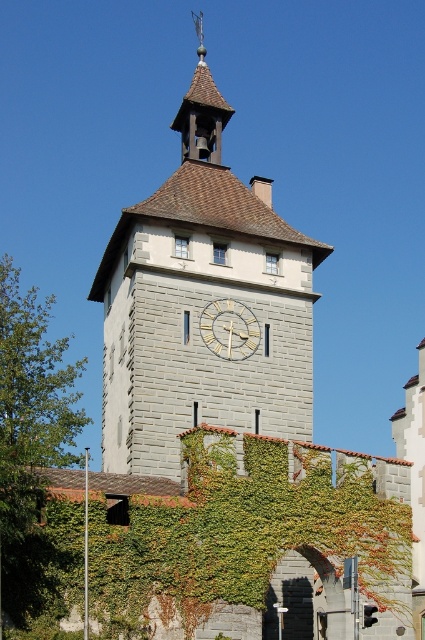
Is polished copper bell at upper center bigger than white wooden clock at center?

Yes.

Can you confirm if polished copper bell at upper center is wider than white wooden clock at center?

Yes.

Does point (218, 93) lie in front of point (221, 337)?

No, (218, 93) is further to viewer.

The width and height of the screenshot is (425, 640). Find the location of `polished copper bell at upper center`. polished copper bell at upper center is located at coordinates (201, 109).

Looking at this image, is green ivy at center below polished copper bell at upper center?

Indeed, green ivy at center is positioned under polished copper bell at upper center.

Is green ivy at center positioned in front of polished copper bell at upper center?

Yes, green ivy at center is in front of polished copper bell at upper center.

Does point (31, 554) come in front of point (206, 74)?

Yes, it is.

Find the location of a particular element. Image resolution: width=425 pixels, height=640 pixels. green ivy at center is located at coordinates (238, 532).

Is gray stone clock tower at center to the right of polished copper bell at upper center from the viewer's perspective?

Incorrect, gray stone clock tower at center is not on the right side of polished copper bell at upper center.

This screenshot has height=640, width=425. What are the coordinates of `gray stone clock tower at center` in the screenshot? It's located at (201, 301).